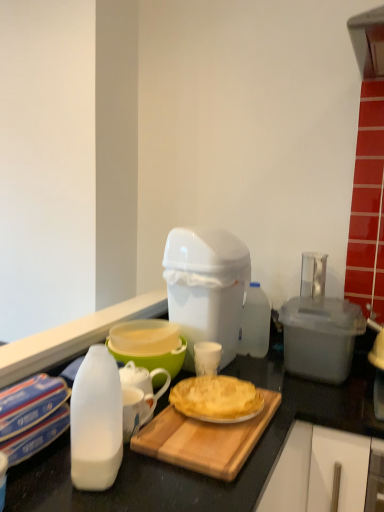
Locate an element on the screen. The height and width of the screenshot is (512, 384). free space above wooden cutting board at center (from a real-world perspective) is located at coordinates (198, 426).